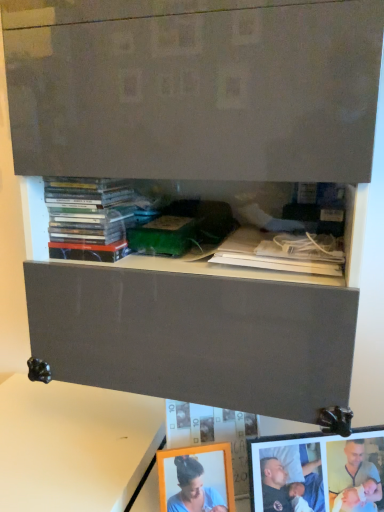
You are a GUI agent. You are given a task and a screenshot of the screen. Output one action in this format:
    pyautogui.click(x=<x>, y=<y>)
    Task: Click on the white matte table at lower left
    This screenshot has height=512, width=384.
    Given the screenshot: What is the action you would take?
    pyautogui.click(x=74, y=445)

Locate an element on the screen. Image resolution: width=384 pixels, height=512 pixels. white paper at upper center, the second book from the left is located at coordinates [283, 252].

Does point (86, 448) appear closer or farther from the camera than point (96, 227)?

Point (86, 448) appears to be farther away from the viewer than point (96, 227).

Is white matte table at lower left positioned with its back to matte plastic books at upper left, the first book viewed from the left?

white matte table at lower left is not turned away from matte plastic books at upper left, the first book viewed from the left.

What's the angular difference between white matte table at lower left and matte plastic books at upper left, which is the second book in right-to-left order,'s facing directions?

There is a 0.698-degree angle between the facing directions of white matte table at lower left and matte plastic books at upper left, which is the second book in right-to-left order.

Is white matte table at lower left wider or thinner than matte plastic books at upper left, the first book viewed from the left?

white matte table at lower left is wider than matte plastic books at upper left, the first book viewed from the left.

Which is in front, point (52, 201) or point (263, 265)?

The point (263, 265) is closer to the camera.

Can you confirm if matte plastic books at upper left, the first book viewed from the left, is smaller than white paper at upper center, the second book from the left?

No.

From the image's perspective, between matte plastic books at upper left, which is the second book in right-to-left order, and white paper at upper center, the second book from the left, which one is located above?

matte plastic books at upper left, which is the second book in right-to-left order, from the image's perspective.

Is matte wooden picture frame at lower right oriented away from matte plastic books at upper left, the first book viewed from the left?

No, matte wooden picture frame at lower right's orientation is not away from matte plastic books at upper left, the first book viewed from the left.

Which object is thinner, matte wooden picture frame at lower right or matte plastic books at upper left, the first book viewed from the left?

Thinner between the two is matte wooden picture frame at lower right.

From the image's perspective, is matte wooden picture frame at lower right located beneath matte plastic books at upper left, which is the second book in right-to-left order?

Yes, from the image's perspective, matte wooden picture frame at lower right is beneath matte plastic books at upper left, which is the second book in right-to-left order.

Which is in front, point (324, 455) or point (104, 257)?

Positioned in front is point (104, 257).

Does matte wooden picture frame at lower right have a lesser width compared to white matte table at lower left?

Indeed, matte wooden picture frame at lower right has a lesser width compared to white matte table at lower left.

In terms of size, does matte wooden picture frame at lower right appear bigger or smaller than white matte table at lower left?

Clearly, matte wooden picture frame at lower right is smaller in size than white matte table at lower left.

Are matte wooden picture frame at lower right and white matte table at lower left beside each other?

No, matte wooden picture frame at lower right is not next to white matte table at lower left.

Based on the photo, is the position of matte wooden picture frame at lower right more distant than that of white matte table at lower left?

No, matte wooden picture frame at lower right is in front of white matte table at lower left.

Looking at their sizes, would you say white paper at upper center, acting as the 1th book starting from the right, is wider or thinner than matte plastic books at upper left, the first book viewed from the left?

white paper at upper center, acting as the 1th book starting from the right, is wider than matte plastic books at upper left, the first book viewed from the left.

How many degrees apart are the facing directions of white paper at upper center, acting as the 1th book starting from the right, and matte plastic books at upper left, which is the second book in right-to-left order?

The angular difference between white paper at upper center, acting as the 1th book starting from the right, and matte plastic books at upper left, which is the second book in right-to-left order, is 0.000682 degrees.

Considering the relative sizes of white paper at upper center, acting as the 1th book starting from the right, and matte plastic books at upper left, the first book viewed from the left, in the image provided, is white paper at upper center, acting as the 1th book starting from the right, shorter than matte plastic books at upper left, the first book viewed from the left,?

Correct, white paper at upper center, acting as the 1th book starting from the right, is not as tall as matte plastic books at upper left, the first book viewed from the left.

From a real-world perspective, is matte wooden picture frame at lower right physically below white paper at upper center, acting as the 1th book starting from the right?

Correct, in the physical world, matte wooden picture frame at lower right is lower than white paper at upper center, acting as the 1th book starting from the right.

From the image's perspective, is matte wooden picture frame at lower right below white paper at upper center, the second book from the left?

Yes, from the image's perspective, matte wooden picture frame at lower right is below white paper at upper center, the second book from the left.

Which object is positioned more to the left, matte wooden picture frame at lower right or white paper at upper center, the second book from the left?

white paper at upper center, the second book from the left.

Is matte wooden picture frame at lower right inside or outside of white paper at upper center, acting as the 1th book starting from the right?

matte wooden picture frame at lower right is spatially situated outside white paper at upper center, acting as the 1th book starting from the right.

In the scene shown: Is matte plastic books at upper left, the first book viewed from the left, inside or outside of matte wooden picture frame at lower right?

matte plastic books at upper left, the first book viewed from the left, exists outside the volume of matte wooden picture frame at lower right.

From their relative heights in the image, would you say matte plastic books at upper left, which is the second book in right-to-left order, is taller or shorter than matte wooden picture frame at lower right?

Considering their sizes, matte plastic books at upper left, which is the second book in right-to-left order, has less height than matte wooden picture frame at lower right.

Is matte plastic books at upper left, the first book viewed from the left, with matte wooden picture frame at lower right?

matte plastic books at upper left, the first book viewed from the left, is not next to matte wooden picture frame at lower right, and they're not touching.

Between matte plastic books at upper left, which is the second book in right-to-left order, and matte wooden picture frame at lower right, which one has larger width?

matte plastic books at upper left, which is the second book in right-to-left order.

I want to click on table located below the matte plastic books at upper left, which is the second book in right-to-left order (from the image's perspective), so click(x=74, y=445).

At what (x,y) coordinates should I click in order to perform the action: click on book below the matte plastic books at upper left, the first book viewed from the left (from a real-world perspective). Please return your answer as a coordinate pair (x, y). Image resolution: width=384 pixels, height=512 pixels. Looking at the image, I should click on (283, 252).

Estimate the real-world distances between objects in this image. Which object is further from matte wooden picture frame at lower right, white paper at upper center, acting as the 1th book starting from the right, or white matte table at lower left?

Among the two, white matte table at lower left is located further to matte wooden picture frame at lower right.

Estimate the real-world distances between objects in this image. Which object is closer to matte plastic books at upper left, the first book viewed from the left, white paper at upper center, the second book from the left, or matte wooden picture frame at lower right?

Among the two, white paper at upper center, the second book from the left, is located nearer to matte plastic books at upper left, the first book viewed from the left.

Which object lies nearer to the anchor point white matte table at lower left, white paper at upper center, the second book from the left, or matte wooden picture frame at lower right?

matte wooden picture frame at lower right lies closer to white matte table at lower left than the other object.

Considering their positions, is matte wooden picture frame at lower right positioned closer to white paper at upper center, the second book from the left, than matte plastic books at upper left, the first book viewed from the left?

matte plastic books at upper left, the first book viewed from the left.

Estimate the real-world distances between objects in this image. Which object is closer to matte wooden picture frame at lower right, white matte table at lower left or matte plastic books at upper left, which is the second book in right-to-left order?

Among the two, white matte table at lower left is located nearer to matte wooden picture frame at lower right.

Based on their spatial positions, is matte plastic books at upper left, the first book viewed from the left, or white matte table at lower left further from white paper at upper center, the second book from the left?

Among the two, white matte table at lower left is located further to white paper at upper center, the second book from the left.

Looking at the image, which one is located further to white matte table at lower left, matte wooden picture frame at lower right or white paper at upper center, acting as the 1th book starting from the right?

white paper at upper center, acting as the 1th book starting from the right.

Considering their positions, is white paper at upper center, the second book from the left, positioned closer to white matte table at lower left than matte plastic books at upper left, the first book viewed from the left?

matte plastic books at upper left, the first book viewed from the left, lies closer to white matte table at lower left than the other object.

Identify the location of book between matte plastic books at upper left, which is the second book in right-to-left order, and white matte table at lower left, in the vertical direction. The image size is (384, 512). (283, 252).

Where is `picture frame that lies between matte plastic books at upper left, the first book viewed from the left, and white matte table at lower left from top to bottom`? The height and width of the screenshot is (512, 384). picture frame that lies between matte plastic books at upper left, the first book viewed from the left, and white matte table at lower left from top to bottom is located at coordinates (318, 472).

Locate an element on the screen. This screenshot has height=512, width=384. book between matte plastic books at upper left, the first book viewed from the left, and matte wooden picture frame at lower right in the up-down direction is located at coordinates (283, 252).

Locate an element on the screen. picture frame between white paper at upper center, the second book from the left, and white matte table at lower left in the up-down direction is located at coordinates (318, 472).